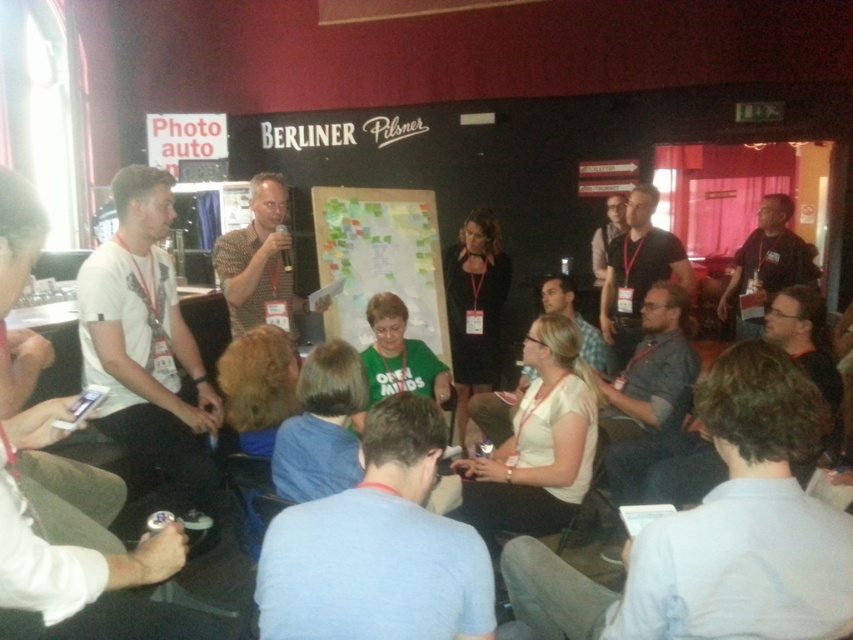
Between brown textured shirt at center and dark gray shirt at upper right, which one has less height?

Standing shorter between the two is brown textured shirt at center.

What do you see at coordinates (258, 259) in the screenshot? I see `brown textured shirt at center` at bounding box center [258, 259].

Describe the element at coordinates (258, 259) in the screenshot. This screenshot has height=640, width=853. I see `brown textured shirt at center` at that location.

Find the location of a particular element. brown textured shirt at center is located at coordinates (258, 259).

Looking at this image, between dark gray shirt at center and dark gray shirt at upper right, which one has less height?

dark gray shirt at upper right is shorter.

In order to click on dark gray shirt at center in this screenshot , I will do pos(636,273).

Find the location of `dark gray shirt at center`. dark gray shirt at center is located at coordinates (636, 273).

Who is higher up, dark gray shirt at center or white matte shirt at center?

Positioned higher is dark gray shirt at center.

Who is more forward, (636,252) or (512,392)?

Point (636,252) is in front.

Where is `dark gray shirt at center`? The image size is (853, 640). dark gray shirt at center is located at coordinates (636, 273).